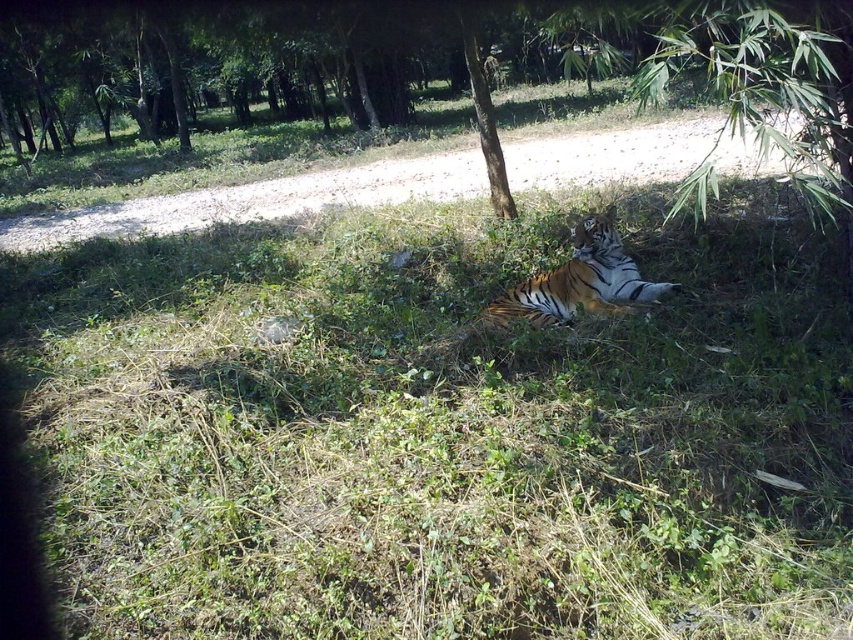
Does orange-yellow fur tiger at center have a greater width compared to green textured tree at upper center?

Indeed, orange-yellow fur tiger at center has a greater width compared to green textured tree at upper center.

Which of these two, orange-yellow fur tiger at center or green textured tree at upper center, stands shorter?

orange-yellow fur tiger at center is shorter.

Measure the distance between point (531, 291) and camera.

A distance of 5.16 meters exists between point (531, 291) and camera.

You are a GUI agent. You are given a task and a screenshot of the screen. Output one action in this format:
    pyautogui.click(x=<x>, y=<y>)
    Task: Click on the orange-yellow fur tiger at center
    This screenshot has width=853, height=640.
    Given the screenshot: What is the action you would take?
    pyautogui.click(x=579, y=282)